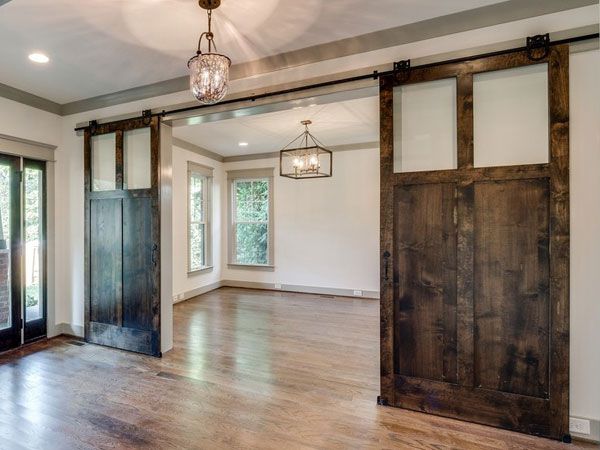
Where is `door seal`? The height and width of the screenshot is (450, 600). door seal is located at coordinates (49, 187).